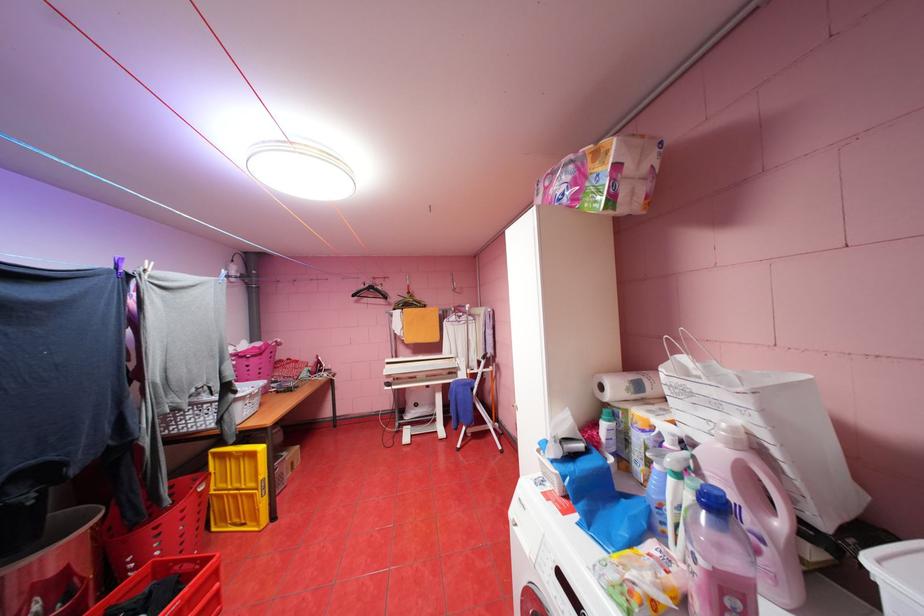
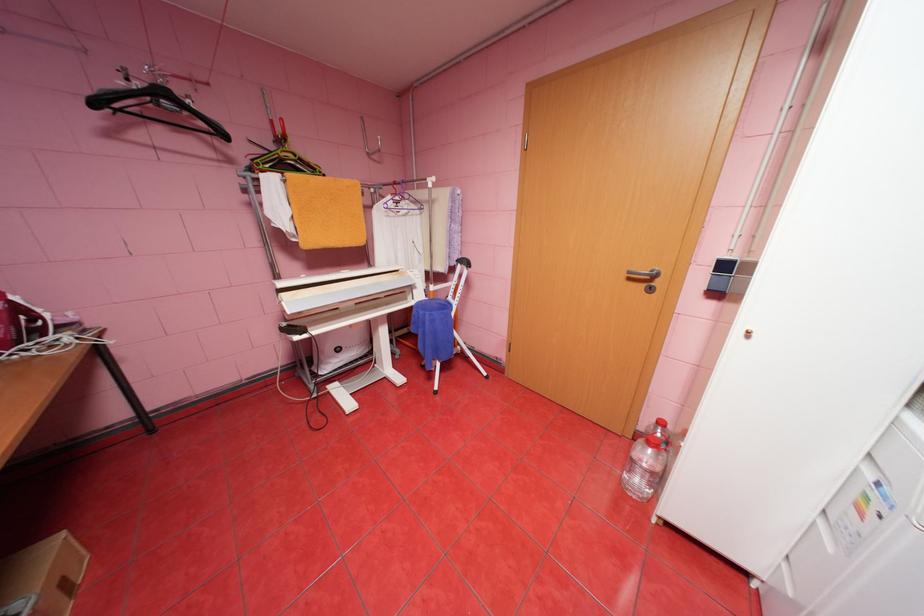
In the second image, find the point that corresponds to point 361,294 in the first image.

(103, 103)